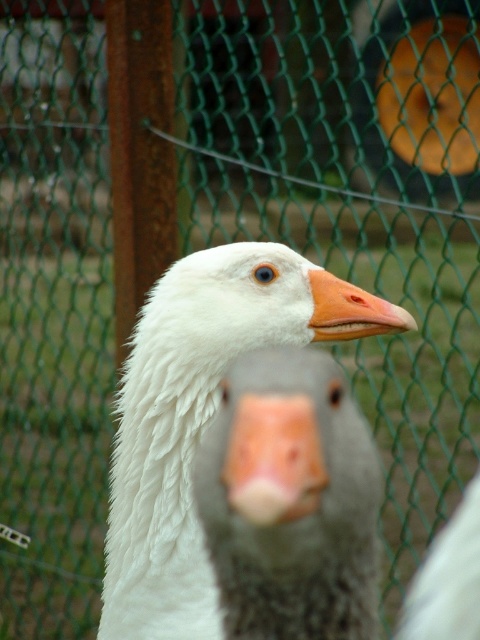
Question: Which of the following is the closest to the observer?

Choices:
 (A) matte gray goose at center
 (B) pink matte nose at center
 (C) gray matte goose at center

Answer: (C)

Question: Considering the relative positions of matte gray goose at center and orange matte beak at center in the image provided, where is matte gray goose at center located with respect to orange matte beak at center?

Choices:
 (A) right
 (B) left

Answer: (A)

Question: Which point is farther to the camera?

Choices:
 (A) (255, 470)
 (B) (448, 557)

Answer: (B)

Question: Can you confirm if white matte duck at center is smaller than orange matte beak at center?

Choices:
 (A) no
 (B) yes

Answer: (A)

Question: Does white matte duck at center appear on the left side of orange matte beak at center?

Choices:
 (A) no
 (B) yes

Answer: (B)

Question: Based on their relative distances, which object is nearer to the orange matte beak at center?

Choices:
 (A) matte gray goose at center
 (B) pink matte nose at center
 (C) white matte duck at center
 (D) gray matte goose at center

Answer: (C)